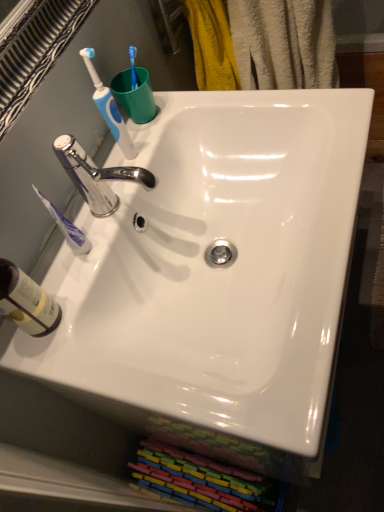
Question: Should I look upward or downward to see white glossy sink at center?

Choices:
 (A) down
 (B) up

Answer: (B)

Question: From a real-world perspective, is translucent plastic bottle at lower left positioned over blue plastic toothbrush at upper left, which is the first toothbrush from top to bottom, based on gravity?

Choices:
 (A) no
 (B) yes

Answer: (A)

Question: From the image's perspective, is translucent plastic bottle at lower left over blue plastic toothbrush at upper left, the second toothbrush positioned from the bottom?

Choices:
 (A) yes
 (B) no

Answer: (B)

Question: Is translucent plastic bottle at lower left further to the viewer compared to blue plastic toothbrush at upper left, which is the first toothbrush from top to bottom?

Choices:
 (A) no
 (B) yes

Answer: (A)

Question: Is translucent plastic bottle at lower left aimed at blue plastic toothbrush at upper left, the second toothbrush positioned from the bottom?

Choices:
 (A) no
 (B) yes

Answer: (A)

Question: Can you confirm if translucent plastic bottle at lower left is shorter than blue plastic toothbrush at upper left, the second toothbrush positioned from the bottom?

Choices:
 (A) yes
 (B) no

Answer: (A)

Question: Does translucent plastic bottle at lower left lie in front of blue plastic toothbrush at upper left, the second toothbrush positioned from the bottom?

Choices:
 (A) no
 (B) yes

Answer: (B)

Question: From a real-world perspective, is translucent plastic bottle at lower left below white glossy sink at center?

Choices:
 (A) no
 (B) yes

Answer: (A)

Question: Can you confirm if translucent plastic bottle at lower left is wider than white glossy sink at center?

Choices:
 (A) no
 (B) yes

Answer: (A)

Question: Considering the relative sizes of translucent plastic bottle at lower left and white glossy sink at center in the image provided, is translucent plastic bottle at lower left bigger than white glossy sink at center?

Choices:
 (A) no
 (B) yes

Answer: (A)

Question: Is translucent plastic bottle at lower left taller than white glossy sink at center?

Choices:
 (A) yes
 (B) no

Answer: (A)

Question: Is translucent plastic bottle at lower left at the right side of white glossy sink at center?

Choices:
 (A) yes
 (B) no

Answer: (B)

Question: Considering the relative sizes of translucent plastic bottle at lower left and white glossy sink at center in the image provided, is translucent plastic bottle at lower left thinner than white glossy sink at center?

Choices:
 (A) no
 (B) yes

Answer: (B)

Question: Can you confirm if blue plastic toothbrush at upper left, the second toothbrush positioned from the bottom, is wider than white glossy sink at center?

Choices:
 (A) yes
 (B) no

Answer: (B)